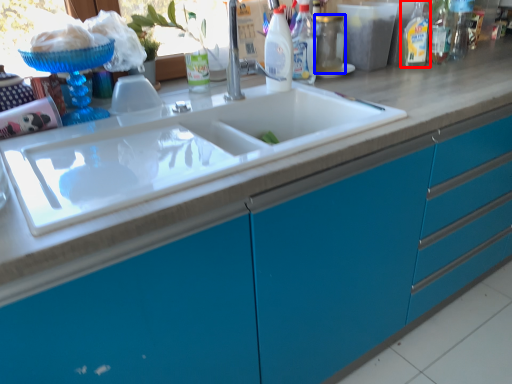
Question: Which object is further to the camera taking this photo, cleaning product (highlighted by a red box) or bottle (highlighted by a blue box)?

Choices:
 (A) cleaning product
 (B) bottle

Answer: (A)